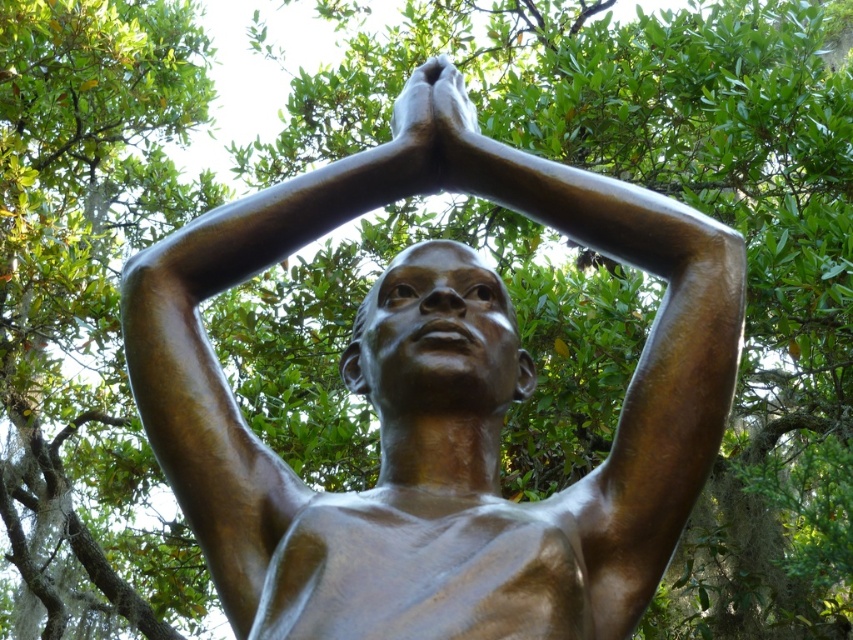
Is bronze/metallic muscle at center above bronze at center?

Actually, bronze/metallic muscle at center is below bronze at center.

How distant is bronze/metallic muscle at center from bronze at center?

A distance of 4.87 feet exists between bronze/metallic muscle at center and bronze at center.

This screenshot has width=853, height=640. What do you see at coordinates (422, 570) in the screenshot? I see `bronze/metallic muscle at center` at bounding box center [422, 570].

Find the location of a particular element. bronze/metallic muscle at center is located at coordinates (422, 570).

Is point (457, 296) behind point (421, 108)?

No, it is not.

Can you confirm if bronze statue at center is positioned to the left of bronze at center?

Yes, bronze statue at center is to the left of bronze at center.

What do you see at coordinates (437, 410) in the screenshot?
I see `bronze statue at center` at bounding box center [437, 410].

Identify the location of bronze statue at center. 437,410.

Who is positioned more to the right, bronze statue at center or bronze/metallic muscle at center?

Positioned to the right is bronze/metallic muscle at center.

Looking at this image, does bronze statue at center have a smaller size compared to bronze/metallic muscle at center?

Incorrect, bronze statue at center is not smaller in size than bronze/metallic muscle at center.

Locate an element on the screen. bronze statue at center is located at coordinates click(x=437, y=410).